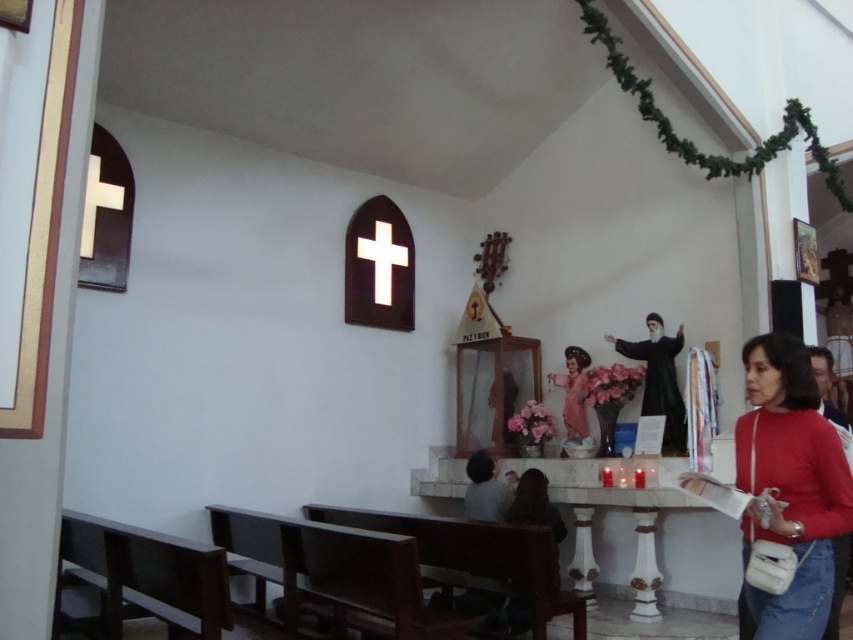
Who is higher up, matte red sweater at lower right or dark brown wood church bench at lower left?

matte red sweater at lower right is higher up.

Between matte red sweater at lower right and dark brown wood church bench at lower left, which one has less height?

Standing shorter between the two is dark brown wood church bench at lower left.

Image resolution: width=853 pixels, height=640 pixels. What do you see at coordinates (788, 484) in the screenshot?
I see `matte red sweater at lower right` at bounding box center [788, 484].

This screenshot has height=640, width=853. I want to click on matte red sweater at lower right, so click(788, 484).

Is dark brown wood church bench at lower left closer to the viewer compared to white glossy cross at upper center?

Yes, it is.

Can you confirm if dark brown wood church bench at lower left is wider than white glossy cross at upper center?

Yes, dark brown wood church bench at lower left is wider than white glossy cross at upper center.

Describe the element at coordinates (332, 573) in the screenshot. The width and height of the screenshot is (853, 640). I see `dark brown wood church bench at lower left` at that location.

I want to click on dark brown wood church bench at lower left, so click(x=332, y=573).

Where is `pink satin doll at center`? The image size is (853, 640). pink satin doll at center is located at coordinates (573, 392).